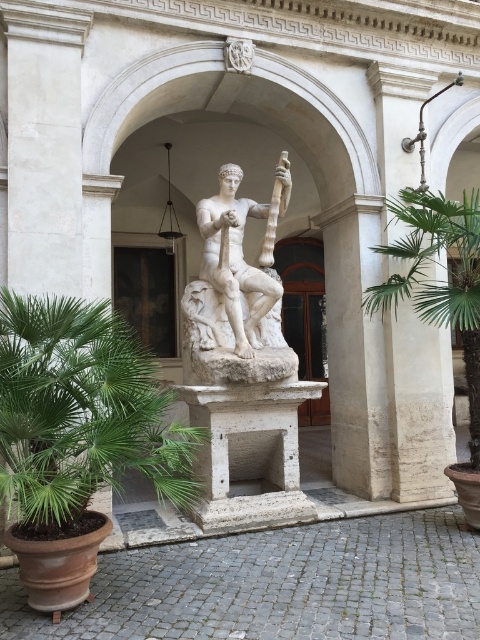
You are standing in the classical architectural setting and want to take a photo of the white marble statue at center. To ensure the statue is perfectly centered in your shot, where should you position yourself relative to the statue?

The white marble statue at center is located at point coordinates approximately 0.452 on the x and 0.492 on the y axis, so you should position yourself directly in front of the statue at its central coordinates to ensure it is perfectly centered in your photo.

You are an architect designing a new museum exhibit and need to place a new sculpture exactly 0.5 meters to the right of the white marble statue at center. Given that the statue is located at point coordinates (236,289), what would be the new coordinates for the placement of the new sculpture?

The new coordinates would be 0.452 plus 0.5 meters in the x direction, so 0.952, 0.492.